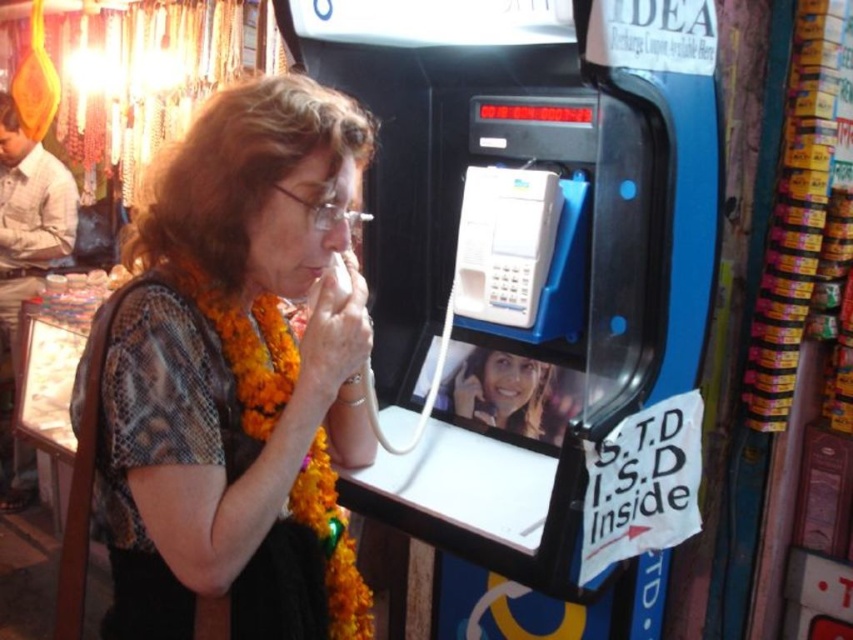
You are a photographer trying to capture the woman and the payphone booth in a single frame. Given that your camera has a limited field of view, can you fit both the matte brown blouse at center and the white plastic payphone at center in the shot if the blouse is wider than the phone?

The matte brown blouse at center is wider than the white plastic payphone at center. Since the blouse is wider, it may occupy more of the frame, but as both are at the center, they should still be visible within the same shot.

You are a photographer standing at the busy street market. You want to take a photo of the matte brown blouse at center and the white plastic payphone at center so that both are clearly visible. Based on their positions, which object should you focus on first to ensure both are in frame?

The matte brown blouse at center is below the white plastic payphone at center. Since the blouse is lower in the image, you should focus on the white plastic payphone at center first to ensure the blouse remains within the frame as you adjust the camera angle downward.